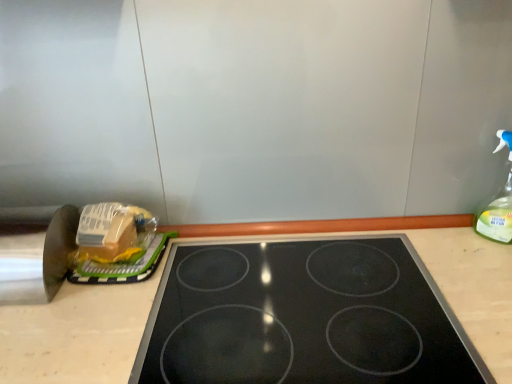
Question: Is translucent plastic bag at left at the left side of black glass gas stove at center?

Choices:
 (A) no
 (B) yes

Answer: (B)

Question: Does translucent plastic bag at left have a smaller size compared to black glass gas stove at center?

Choices:
 (A) yes
 (B) no

Answer: (A)

Question: From a real-world perspective, is translucent plastic bag at left located beneath black glass gas stove at center?

Choices:
 (A) yes
 (B) no

Answer: (B)

Question: Is translucent plastic bag at left to the right of black glass gas stove at center from the viewer's perspective?

Choices:
 (A) no
 (B) yes

Answer: (A)

Question: Is black glass gas stove at center located within translucent plastic bag at left?

Choices:
 (A) yes
 (B) no

Answer: (B)

Question: From the image's perspective, is translucent plastic bag at left above black glass gas stove at center?

Choices:
 (A) yes
 (B) no

Answer: (A)

Question: Is clear plastic spray bottle at right positioned in front of translucent plastic bag at left?

Choices:
 (A) no
 (B) yes

Answer: (B)

Question: Can you confirm if clear plastic spray bottle at right is taller than translucent plastic bag at left?

Choices:
 (A) yes
 (B) no

Answer: (A)

Question: Is clear plastic spray bottle at right to the left of translucent plastic bag at left from the viewer's perspective?

Choices:
 (A) yes
 (B) no

Answer: (B)

Question: Does clear plastic spray bottle at right lie behind translucent plastic bag at left?

Choices:
 (A) no
 (B) yes

Answer: (A)

Question: Is clear plastic spray bottle at right facing towards translucent plastic bag at left?

Choices:
 (A) no
 (B) yes

Answer: (A)

Question: Considering the relative sizes of clear plastic spray bottle at right and translucent plastic bag at left in the image provided, is clear plastic spray bottle at right bigger than translucent plastic bag at left?

Choices:
 (A) no
 (B) yes

Answer: (A)

Question: Does translucent plastic bag at left have a lesser height compared to clear plastic spray bottle at right?

Choices:
 (A) yes
 (B) no

Answer: (A)